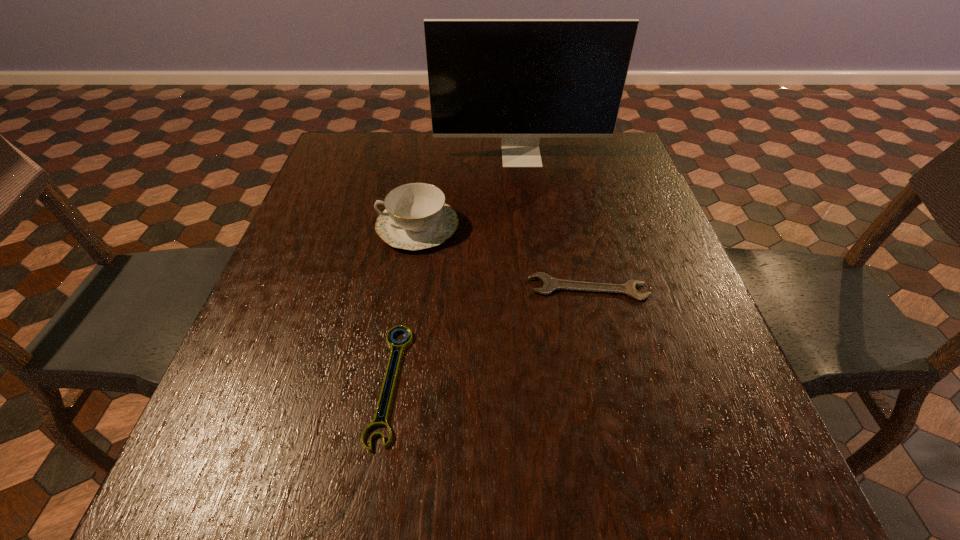
The image size is (960, 540). Find the location of `monitor`. monitor is located at coordinates (520, 80).

Locate an element on the screen. the farthest object is located at coordinates (520, 80).

This screenshot has width=960, height=540. I want to click on the third nearest object, so click(x=416, y=217).

The height and width of the screenshot is (540, 960). Find the location of `chinaware`. chinaware is located at coordinates (416, 217).

I want to click on the right wrench, so click(x=550, y=284).

The image size is (960, 540). In order to click on the taller wrench in this screenshot , I will do `click(550, 284)`.

Where is `the left wrench`? The height and width of the screenshot is (540, 960). the left wrench is located at coordinates (392, 332).

Where is `the shorter wrench`? The height and width of the screenshot is (540, 960). the shorter wrench is located at coordinates (392, 332).

You are a GUI agent. You are given a task and a screenshot of the screen. Output one action in this format:
    pyautogui.click(x=<x>, y=<y>)
    Task: Click on the vacant area located on the front-facing side of the tallest object
    The image size is (960, 540).
    Given the screenshot: What is the action you would take?
    pyautogui.click(x=533, y=255)

This screenshot has height=540, width=960. I want to click on vacant space located 0.200m on the handle side of the second farthest object, so click(x=295, y=227).